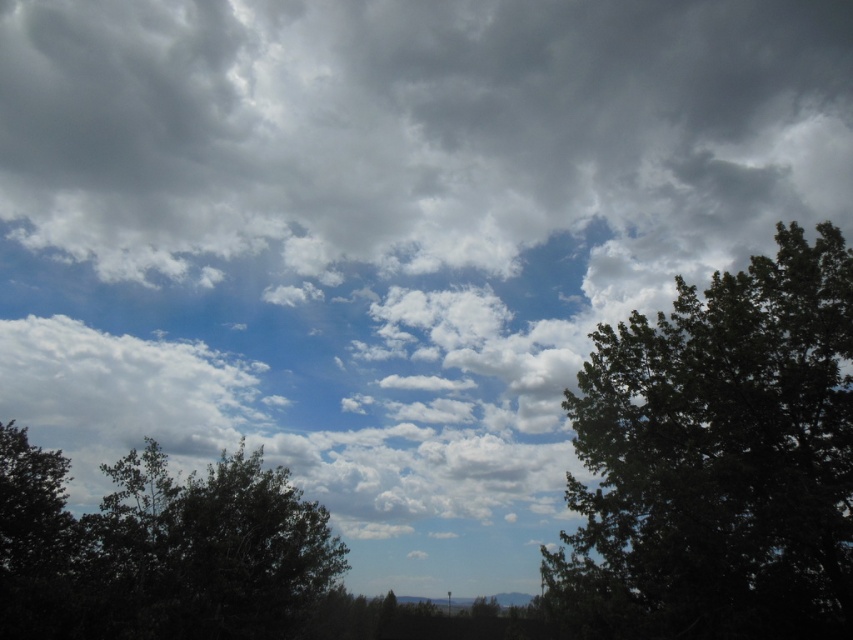
Does gray fluffy cloud at upper center appear on the left side of green leafy tree at right?

Correct, you'll find gray fluffy cloud at upper center to the left of green leafy tree at right.

Does point (247, 156) lie in front of point (631, 596)?

No.

Measure the distance between point (x=743, y=74) and camera.

Point (x=743, y=74) and camera are 171.50 feet apart.

You are a GUI agent. You are given a task and a screenshot of the screen. Output one action in this format:
    pyautogui.click(x=<x>, y=<y>)
    Task: Click on the gray fluffy cloud at upper center
    This screenshot has height=640, width=853.
    Given the screenshot: What is the action you would take?
    pyautogui.click(x=413, y=129)

Which is more to the left, green leafy tree at right or dark green leafy tree at lower left?

dark green leafy tree at lower left

Based on the photo, who is taller, green leafy tree at right or dark green leafy tree at lower left?

green leafy tree at right is taller.

Does point (782, 228) come farther from viewer compared to point (13, 522)?

No, (782, 228) is closer to viewer.

This screenshot has width=853, height=640. I want to click on green leafy tree at right, so (x=718, y=460).

Which is more to the left, gray fluffy cloud at upper center or dark green leafy tree at lower left?

Positioned to the left is dark green leafy tree at lower left.

Is point (361, 138) positioned after point (193, 516)?

That is True.

The width and height of the screenshot is (853, 640). What are the coordinates of `gray fluffy cloud at upper center` in the screenshot? It's located at tap(413, 129).